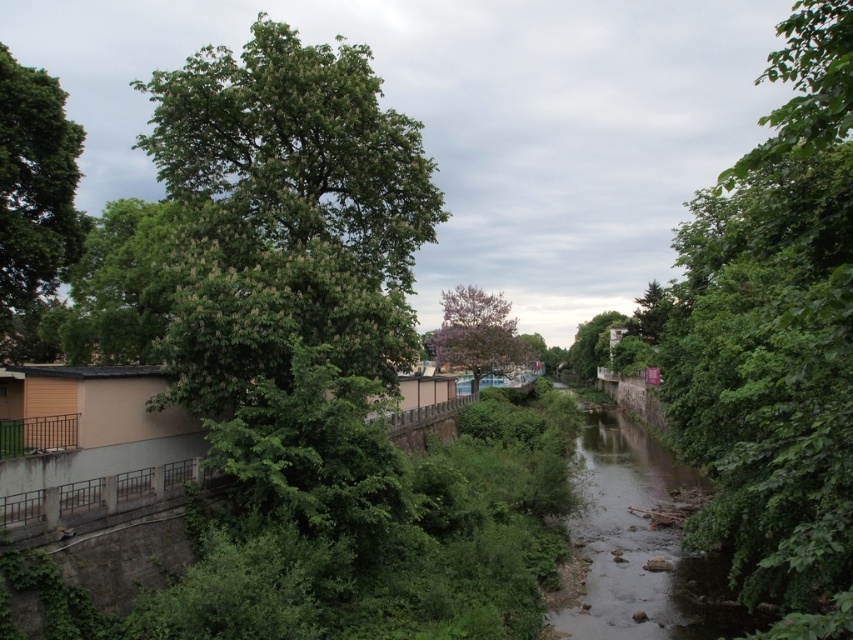
Which is above, green leafy tree at center or purple-pink blossoming tree at center?

green leafy tree at center is higher up.

Who is taller, green leafy tree at center or purple-pink blossoming tree at center?

green leafy tree at center

Who is more distant from viewer, (780, 186) or (442, 356)?

The point (442, 356) is more distant.

Find the location of `green leafy tree at center`. green leafy tree at center is located at coordinates (775, 340).

Between point (791, 202) and point (38, 202), which one is positioned behind?

Point (38, 202)

What do you see at coordinates (775, 340) in the screenshot?
I see `green leafy tree at center` at bounding box center [775, 340].

This screenshot has height=640, width=853. In order to click on green leafy tree at center in this screenshot , I will do `click(775, 340)`.

Is green leafy tree at center below green leafy tree at center-right?

Actually, green leafy tree at center is above green leafy tree at center-right.

The height and width of the screenshot is (640, 853). What do you see at coordinates (775, 340) in the screenshot?
I see `green leafy tree at center` at bounding box center [775, 340].

I want to click on green leafy tree at center, so click(x=775, y=340).